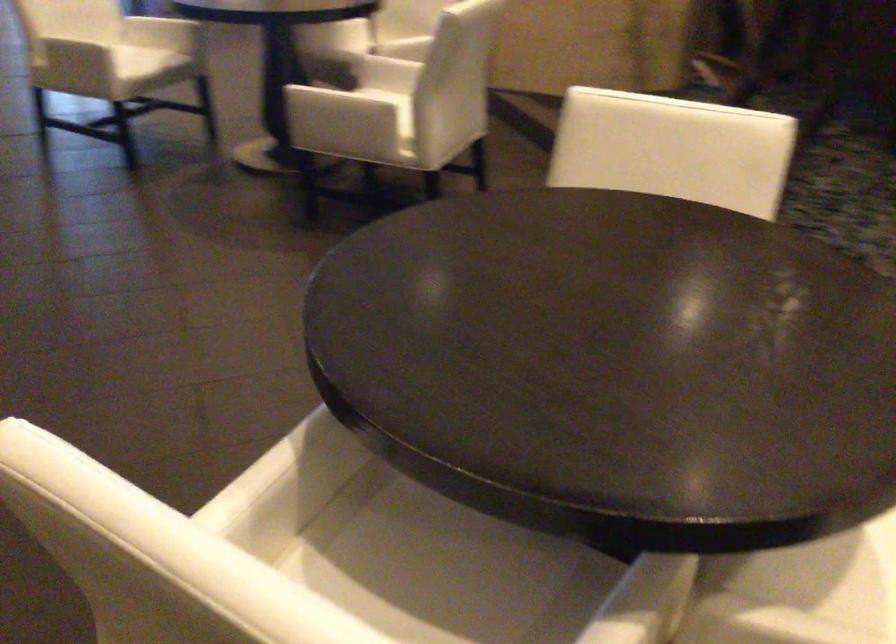
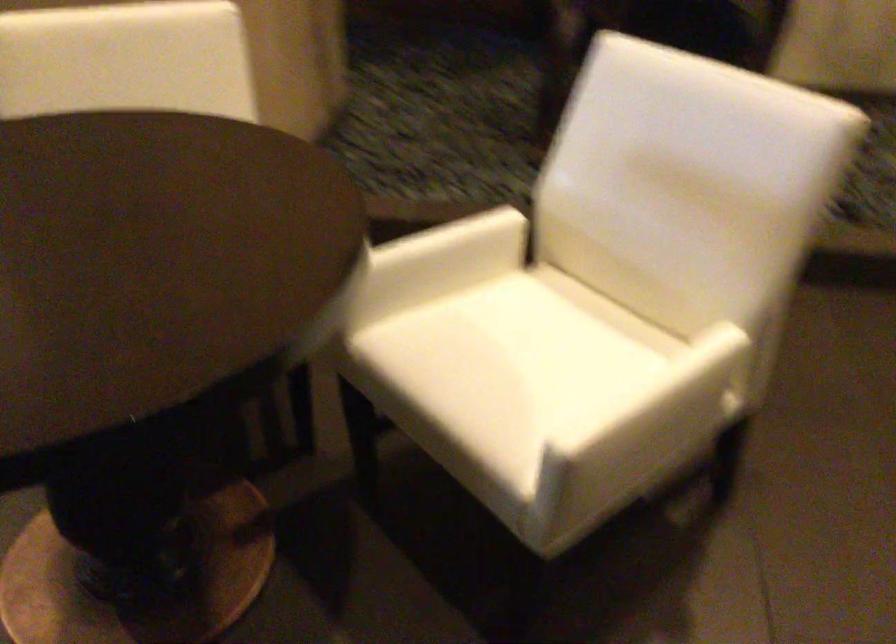
Find the pixel in the second image that matches point (321, 86) in the first image.

(684, 402)